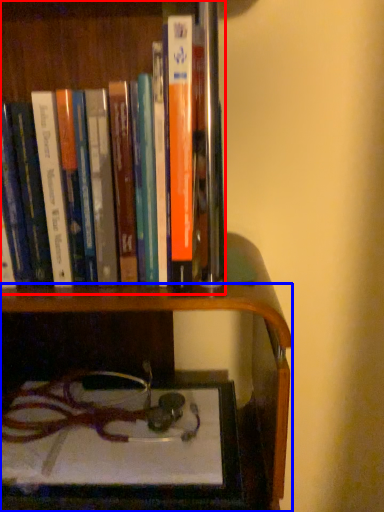
Question: Which point is further to the camera, book (highlighted by a red box) or shelf (highlighted by a blue box)?

Choices:
 (A) book
 (B) shelf

Answer: (B)